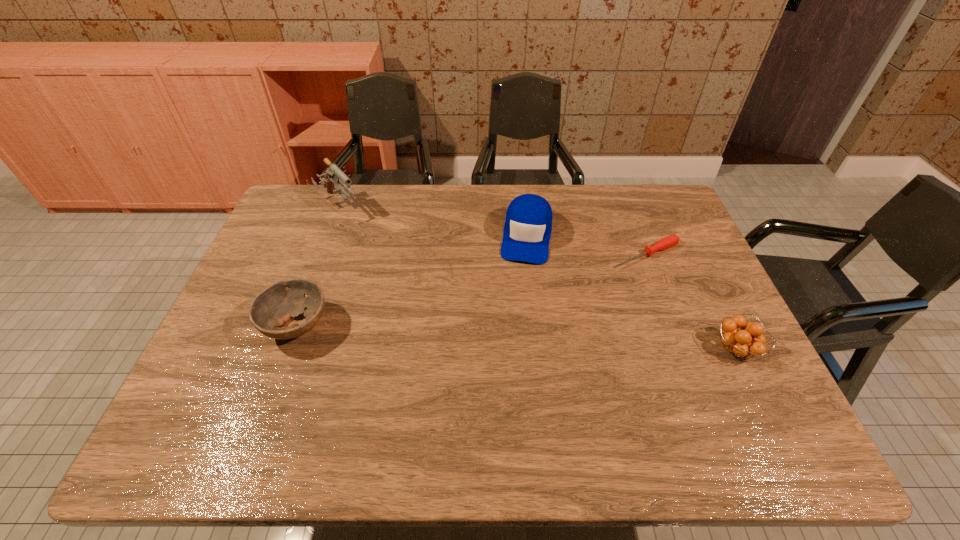
Find the location of a particular element. free point between the gun and the screwdriver is located at coordinates 493,230.

Where is `empty space that is in between the shortest object and the third object from left to right`? empty space that is in between the shortest object and the third object from left to right is located at coordinates (587, 245).

Find the location of a particular element. This screenshot has height=540, width=960. free space between the screwdriver and the bowl is located at coordinates (471, 290).

At what (x,y) coordinates should I click in order to perform the action: click on free space between the fourth shortest object and the screwdriver. Please return your answer as a coordinate pair (x, y). The width and height of the screenshot is (960, 540). Looking at the image, I should click on (587, 245).

You are a GUI agent. You are given a task and a screenshot of the screen. Output one action in this format:
    pyautogui.click(x=<x>, y=<y>)
    Task: Click on the free space between the orange fruit and the second tallest object
    Image resolution: width=960 pixels, height=540 pixels.
    Given the screenshot: What is the action you would take?
    pyautogui.click(x=632, y=293)

Locate an element on the screen. The height and width of the screenshot is (540, 960). vacant point located between the screwdriver and the bowl is located at coordinates (471, 290).

I want to click on vacant area that lies between the screwdriver and the second tallest object, so click(x=587, y=245).

The height and width of the screenshot is (540, 960). I want to click on vacant point located between the tallest object and the second tallest object, so click(x=433, y=221).

You are a GUI agent. You are given a task and a screenshot of the screen. Output one action in this format:
    pyautogui.click(x=<x>, y=<y>)
    Task: Click on the free space between the bowl and the fourth shortest object
    This screenshot has width=960, height=540.
    Given the screenshot: What is the action you would take?
    pyautogui.click(x=412, y=281)

In order to click on vacant area that lies between the tallest object and the fourth shortest object in this screenshot , I will do `click(433, 221)`.